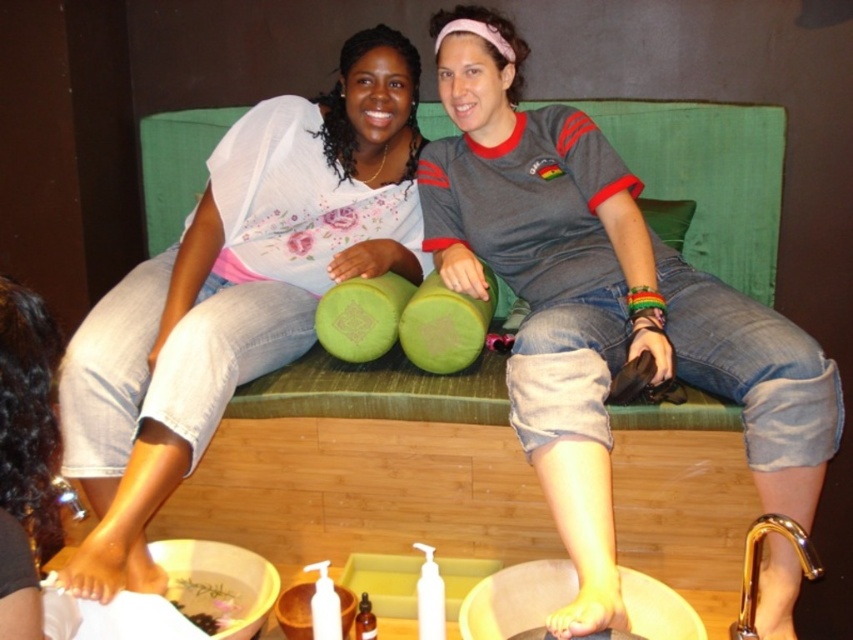
You are a photographer taking a portrait of the two people sitting on the bench. You want to ensure the matte gray shirt at center and the green fabric pillow at center are both clearly visible in the frame. Which object should you position closer to the camera to achieve this?

The matte gray shirt at center is positioned on the left side of green fabric pillow at center. To ensure both are clearly visible, position the matte gray shirt at center closer to the camera since it is already on the left side, allowing the green fabric pillow at center to be in the same plane but slightly adjusted for visibility.

You are a tailor who needs to place a 1 meter long fabric strip between the matte white blouse at upper left and the green fabric pillow at center. Can you fit it without bending the fabric?

The distance between the matte white blouse at upper left and the green fabric pillow at center is 99.85 centimeters. Since the fabric strip is 1 meter long, which is slightly longer than the available space, it won

Looking at this image, you are a photographer setting up a shoot and want to ensure the matte gray shirt at center and the green fabric pillow at center are both visible in the frame. Based on their positions, which object should you focus on first to capture both in the shot?

The matte gray shirt at center is in front of the green fabric pillow at center, so focusing on the matte gray shirt at center first will ensure both objects are visible in the frame.